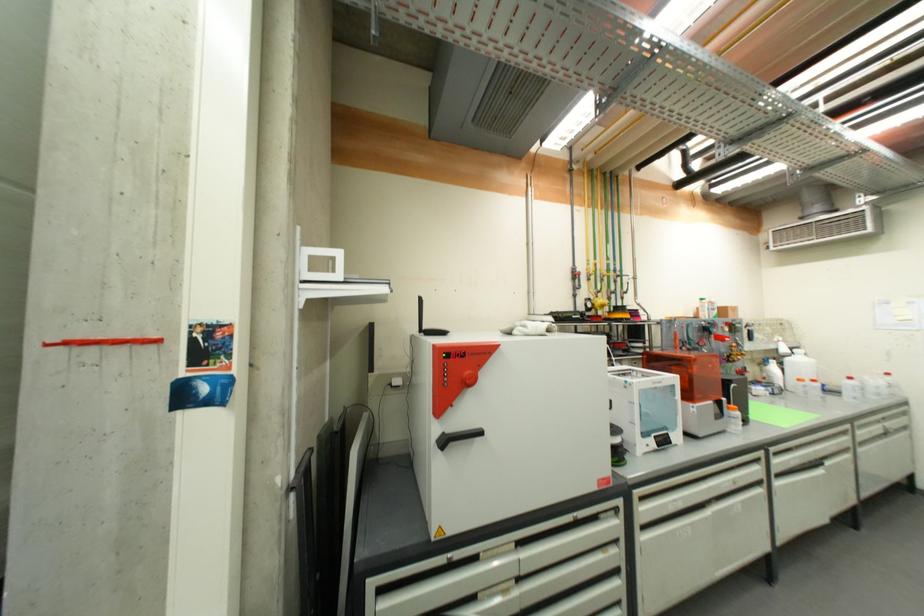
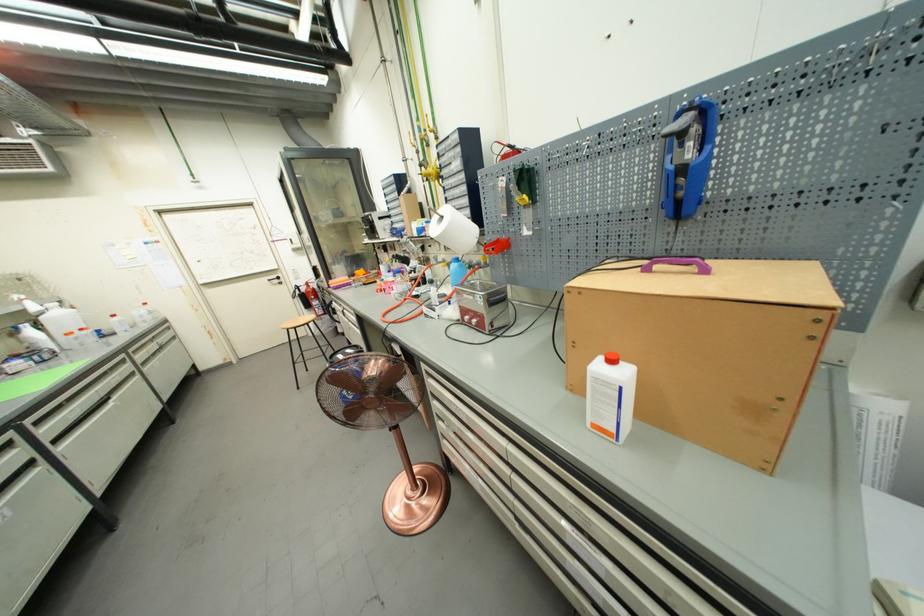
The point at (779, 472) is marked in the first image. Where is the corresponding point in the second image?

(52, 440)